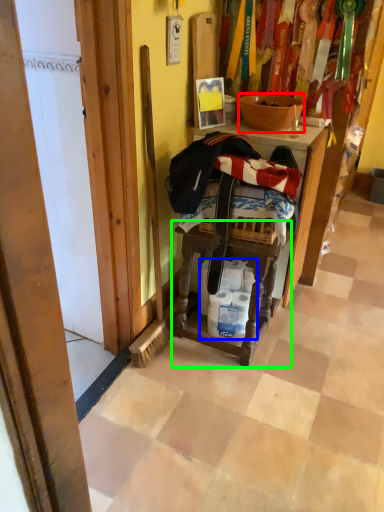
Question: Considering the real-world distances, which object is closest to bowl (highlighted by a red box)? toilet paper (highlighted by a blue box) or step stool (highlighted by a green box).

Choices:
 (A) toilet paper
 (B) step stool

Answer: (B)